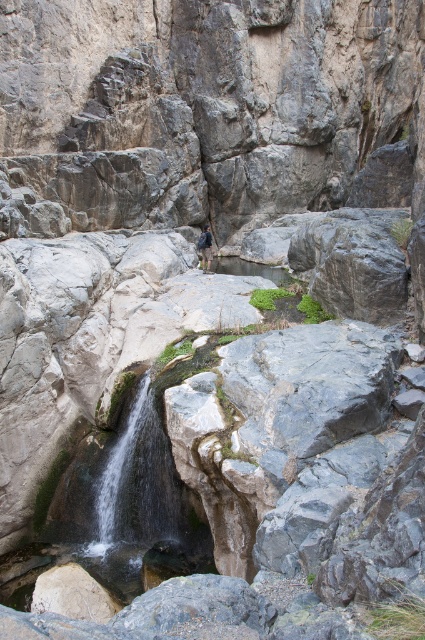
Can you confirm if green mossy rock at center is positioned to the right of dark blue backpack at center?

In fact, green mossy rock at center is to the left of dark blue backpack at center.

This screenshot has width=425, height=640. I want to click on green mossy rock at center, so click(122, 509).

From the picture: Who is more forward, [101,477] or [209,260]?

Point [101,477]

Locate an element on the screen. green mossy rock at center is located at coordinates (122, 509).